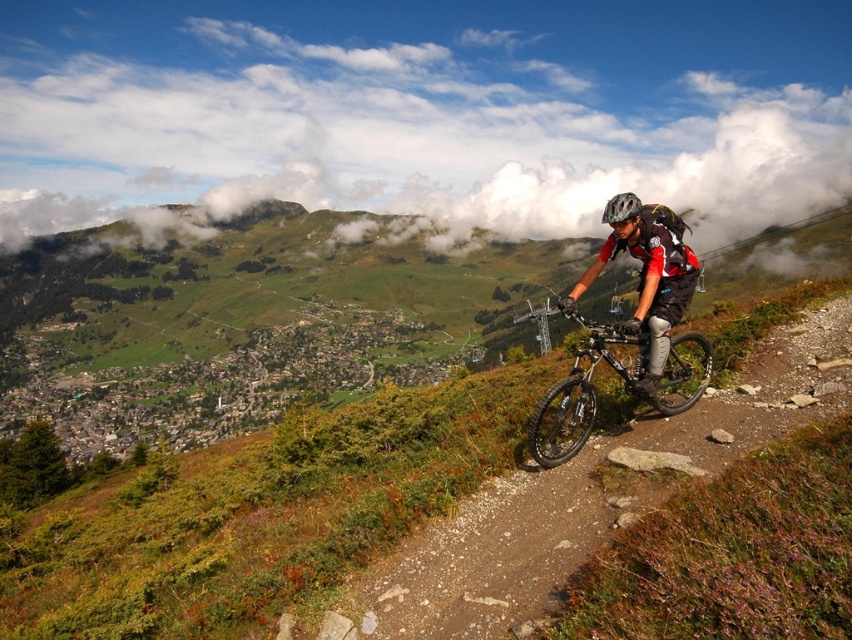
In the scene shown: Is shiny black helmet at upper right thinner than black matte helmet at upper center?

Yes.

Which is behind, point (648, 348) or point (639, 202)?

The point (648, 348) is more distant.

Is point (568, 300) closer to camera compared to point (606, 204)?

Yes, point (568, 300) is in front of point (606, 204).

This screenshot has width=852, height=640. I want to click on shiny black helmet at upper right, so click(649, 280).

Does dirt/gravel path at center-right come in front of black matte helmet at upper center?

Yes, it is in front of black matte helmet at upper center.

Which is below, dirt/gravel path at center-right or black matte helmet at upper center?

dirt/gravel path at center-right is below.

Does point (513, 604) lie behind point (608, 212)?

No.

Locate an element on the screen. This screenshot has height=640, width=852. dirt/gravel path at center-right is located at coordinates (586, 499).

Between dirt/gravel path at center-right and shiny black frame at right, which one has less height?

dirt/gravel path at center-right

Is dirt/gravel path at center-right smaller than shiny black frame at right?

Yes, dirt/gravel path at center-right is smaller than shiny black frame at right.

I want to click on dirt/gravel path at center-right, so click(586, 499).